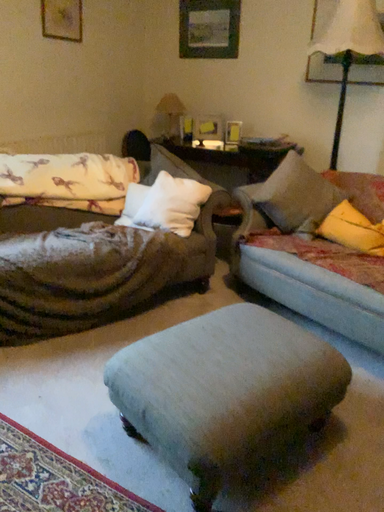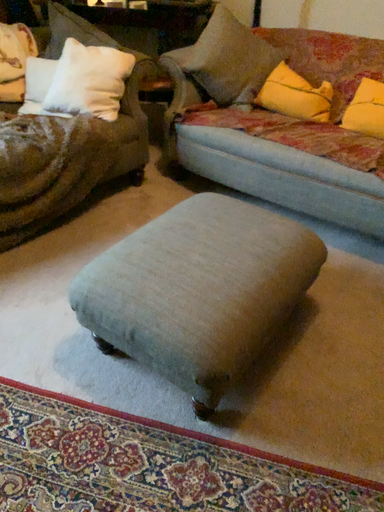
Question: Which way did the camera rotate in the video?

Choices:
 (A) rotated upward
 (B) rotated downward

Answer: (B)